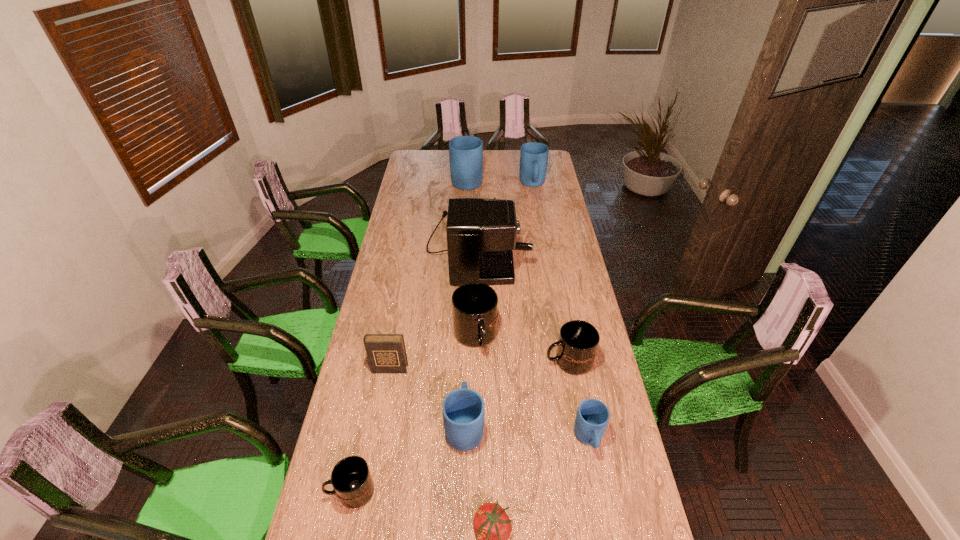
You are a GUI agent. You are given a task and a screenshot of the screen. Output one action in this format:
    pyautogui.click(x=<x>, y=<y>)
    Task: Click on the coffee maker
    The height and width of the screenshot is (540, 960).
    Given the screenshot: What is the action you would take?
    pyautogui.click(x=481, y=233)

The width and height of the screenshot is (960, 540). What are the coordinates of `the eighth nearest object` in the screenshot? It's located at (481, 233).

In order to click on the ninth shortest object in this screenshot , I will do `click(465, 152)`.

Where is `the tallest mug`? the tallest mug is located at coordinates (465, 152).

This screenshot has height=540, width=960. I want to click on the third smallest blue mug, so click(x=534, y=156).

Identify the location of the second black mug from left to right. (474, 305).

Locate an element on the screen. diary is located at coordinates (386, 353).

Find the location of a particular element. the third biggest blue mug is located at coordinates (463, 409).

Locate an element on the screen. the second biggest black mug is located at coordinates (578, 341).

At what (x,y) coordinates should I click in order to perform the action: click on the smallest blue mug. Please return your answer as a coordinate pair (x, y). The height and width of the screenshot is (540, 960). Looking at the image, I should click on (592, 417).